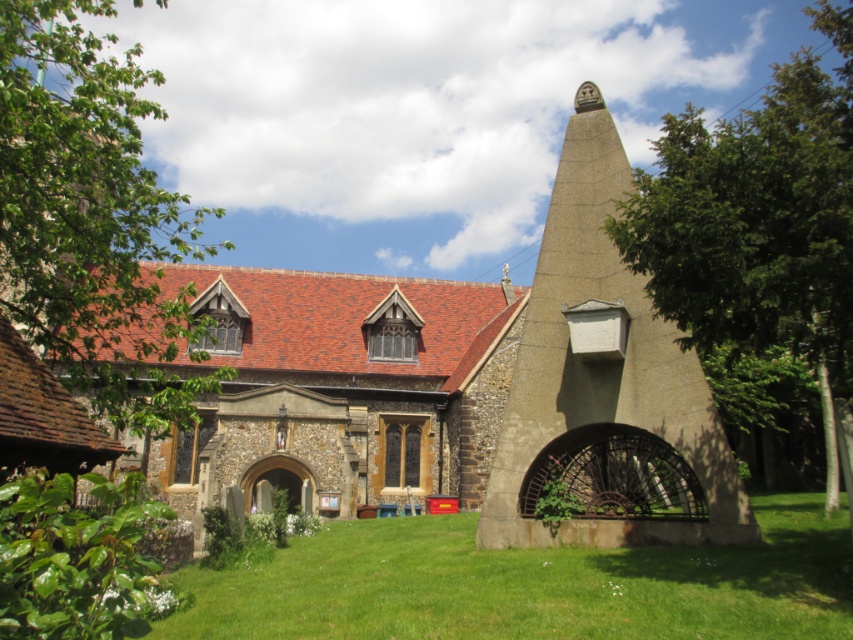
Question: Can you confirm if green grass at lower center is positioned to the left of green leafy tree at right?

Choices:
 (A) yes
 (B) no

Answer: (A)

Question: Which point appears closest to the camera in this image?

Choices:
 (A) (679, 387)
 (B) (659, 280)

Answer: (B)

Question: Is brown stone church at center to the left of green leafy tree at right from the viewer's perspective?

Choices:
 (A) yes
 (B) no

Answer: (A)

Question: Which point is farther to the camera?

Choices:
 (A) green grass at lower center
 (B) brown stone church at center
 (C) green leafy tree at right
 (D) green leafy tree at left

Answer: (B)

Question: Is the position of brown stone church at center more distant than that of green leafy tree at left?

Choices:
 (A) no
 (B) yes

Answer: (B)

Question: Which point is farther to the camera?

Choices:
 (A) (801, 600)
 (B) (828, 282)
 (C) (680, 372)

Answer: (C)